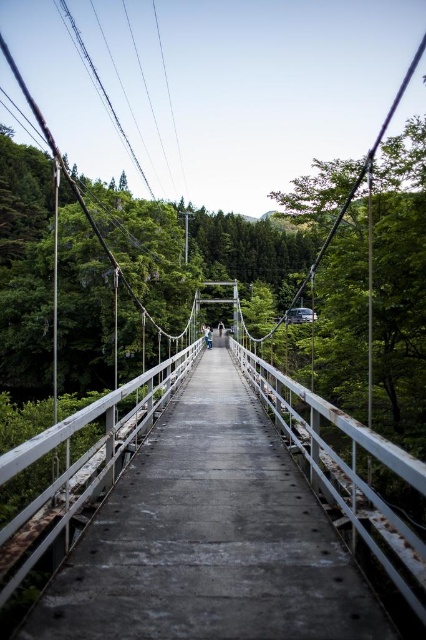
In the scene shown: You are standing on the suspension bridge and notice a light blue denim jacket at center. Based on the scene, where is the jacket located relative to the rusty concrete bridge at center?

The light blue denim jacket at center is above the rusty concrete bridge at center since the bridge is below the jacket.

Looking at this image, you are standing on the rusty concrete bridge at center and looking towards the light blue denim jacket at center. Which object is closer to you?

The rusty concrete bridge at center is closer to you because it is in front of the light blue denim jacket at center.